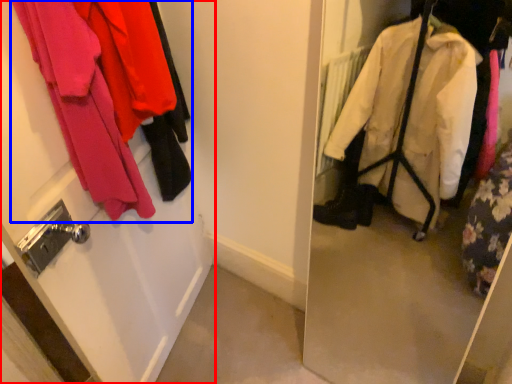
Question: Which object is further to the camera taking this photo, door (highlighted by a red box) or closet (highlighted by a blue box)?

Choices:
 (A) door
 (B) closet

Answer: (B)